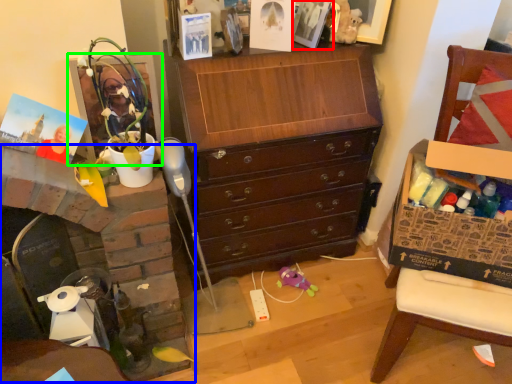
Question: Which is farther away from picture frame (highlighted by a red box)? fireplace (highlighted by a blue box) or picture frame (highlighted by a green box)?

Choices:
 (A) fireplace
 (B) picture frame

Answer: (A)